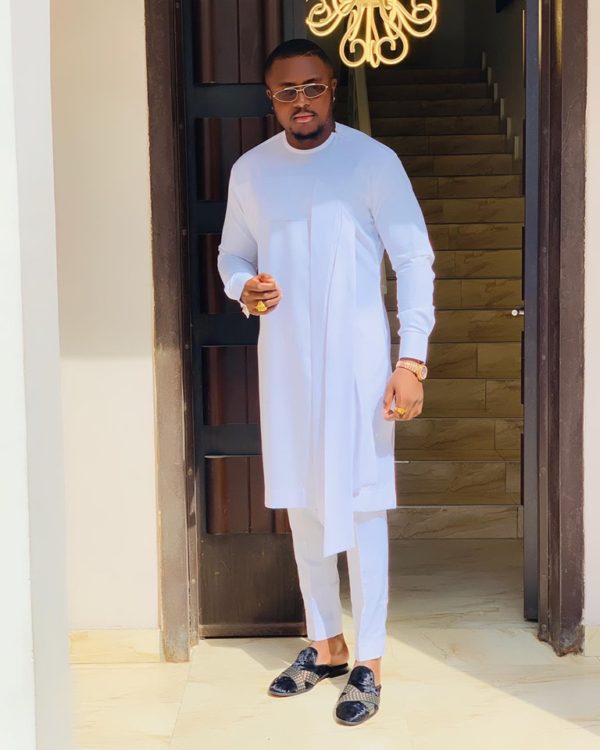
Where is `doorknob`? The height and width of the screenshot is (750, 600). doorknob is located at coordinates (516, 312).